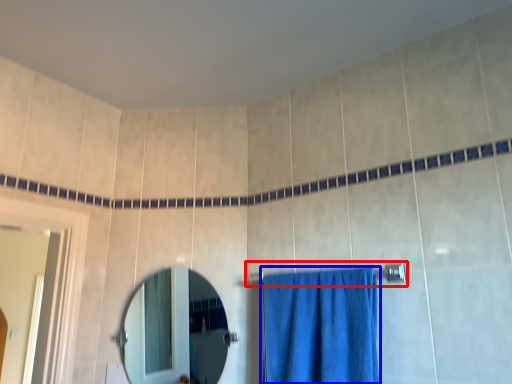
Question: Which of the following is the closest to the observer, towel bar (highlighted by a red box) or curtain (highlighted by a blue box)?

Choices:
 (A) towel bar
 (B) curtain

Answer: (B)